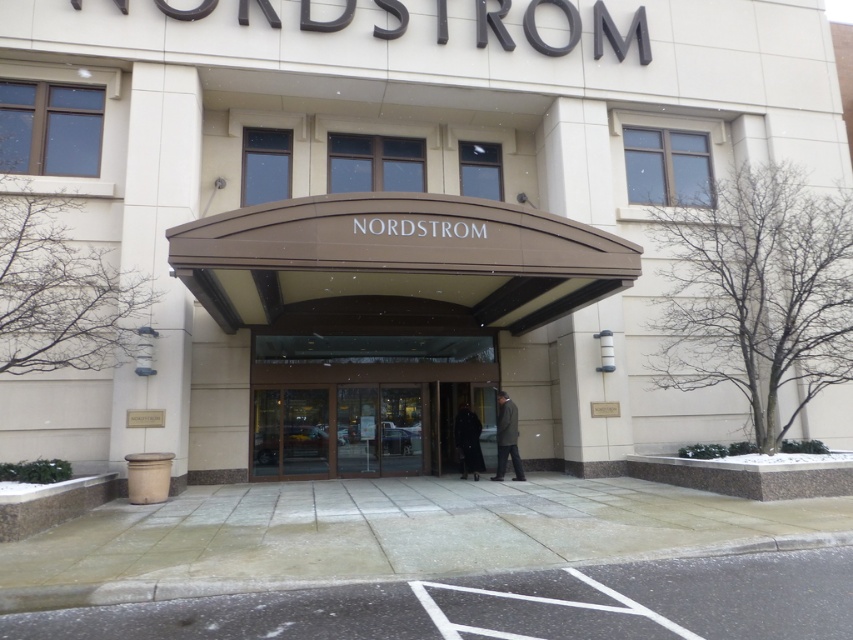
You are standing at the entrance of the Nordstrom store and need to locate two specific points marked on the ground. The first point is at coordinate point(376, 371) and the second is at point(515, 461). Which point is closer to you as you face the store entrance?

Point(376, 371) is closer to you because it is further to the viewer than point(515, 461).

You are a customer at the Nordstrom store entrance. You see a black leather coat at center and a dark wool coat at center. Which coat is positioned higher relative to the other?

The black leather coat at center is positioned higher than the dark wool coat at center.

You are standing at the entrance of the Nordstrom store and want to pick up the black leather coat at center. Can you reach it without moving closer than 50 feet?

The black leather coat at center is 50.10 feet away from the viewer, so you cannot reach it without moving closer than 50 feet.